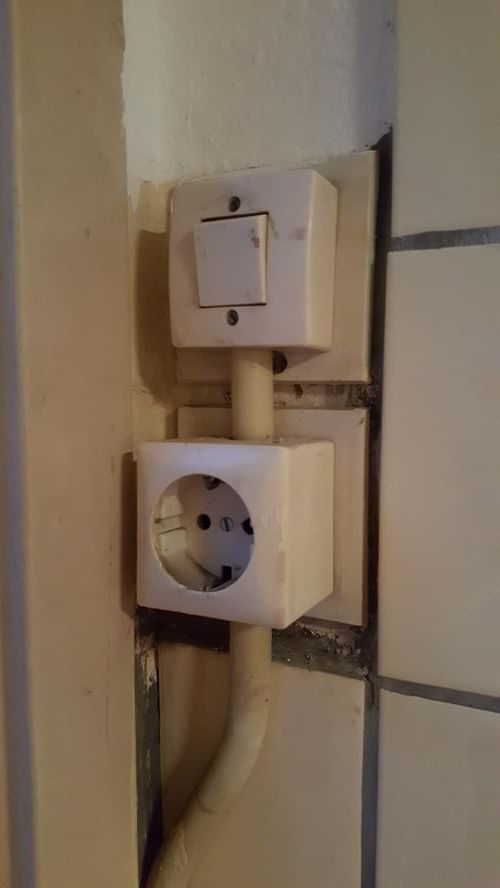
At what (x,y) coordinates should I click in order to perform the action: click on outlet. Please return your answer as a coordinate pair (x, y). The image size is (500, 888). Looking at the image, I should click on tap(235, 556).